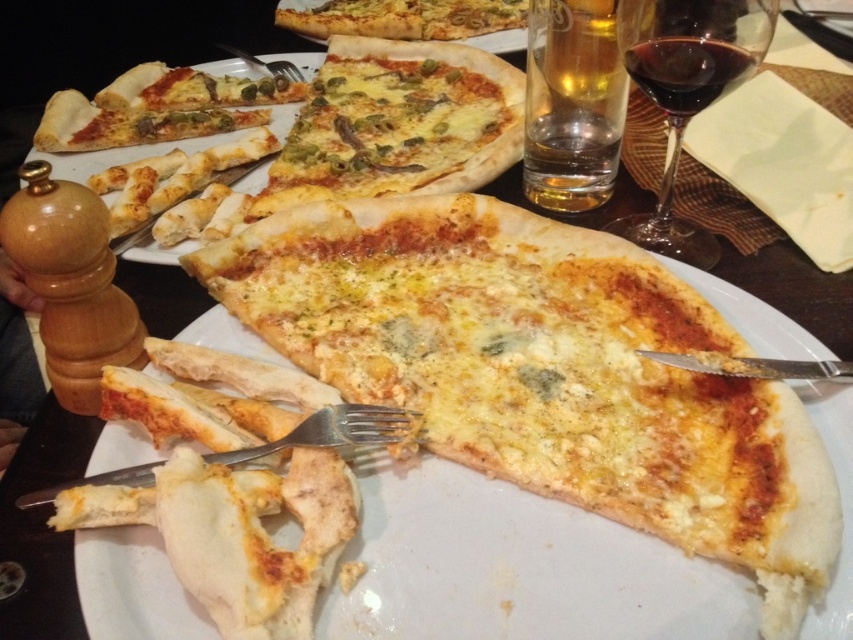
Question: Can you confirm if white crispy crust at lower left is bigger than translucent glass beer at upper right?

Choices:
 (A) no
 (B) yes

Answer: (B)

Question: Which point is farther from the camera taking this photo?

Choices:
 (A) (660, 52)
 (B) (611, 67)

Answer: (B)

Question: Which of these objects is positioned closest to the dark red liquid at upper right?

Choices:
 (A) cheesy pizza at center
 (B) cheesy pizza at upper center
 (C) translucent glass beer at upper right
 (D) silver metallic fork at lower center

Answer: (C)

Question: Which object appears farthest from the camera in this image?

Choices:
 (A) silver metallic fork at lower center
 (B) white crispy crust at lower left
 (C) dark red liquid at upper right

Answer: (C)

Question: Can you confirm if cheesy pizza at center is positioned above translucent glass beer at upper right?

Choices:
 (A) no
 (B) yes

Answer: (B)

Question: Does white crispy crust at lower left lie behind transparent glass wine at upper right?

Choices:
 (A) no
 (B) yes

Answer: (A)